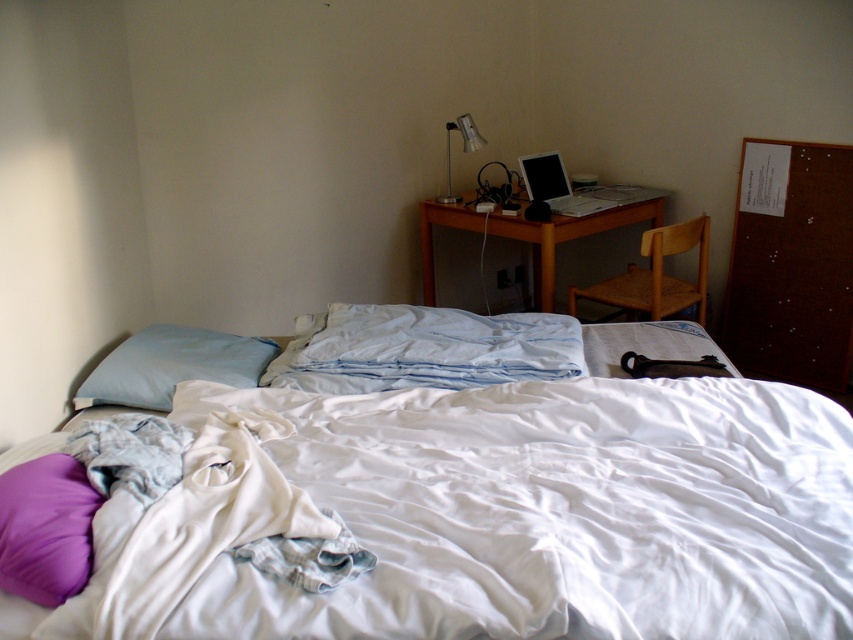
Question: Considering the relative positions of silver metallic laptop at upper right and satin silver lamp at upper center in the image provided, where is silver metallic laptop at upper right located with respect to satin silver lamp at upper center?

Choices:
 (A) right
 (B) left

Answer: (A)

Question: Does wooden chair at right have a lesser width compared to satin silver lamp at upper center?

Choices:
 (A) yes
 (B) no

Answer: (B)

Question: Among these objects, which one is farthest from the camera?

Choices:
 (A) blue cotton sheet at center
 (B) wooden desk at center
 (C) wooden chair at right
 (D) white cotton bed at center

Answer: (B)

Question: Estimate the real-world distances between objects in this image. Which object is closer to the satin silver lamp at upper center?

Choices:
 (A) silver metallic laptop at upper right
 (B) wooden desk at center
 (C) light blue fabric pillow at left

Answer: (B)

Question: Which point is closer to the camera?

Choices:
 (A) wooden desk at center
 (B) wooden chair at right
 (C) blue cotton sheet at center

Answer: (C)

Question: Is wooden chair at right thinner than satin silver lamp at upper center?

Choices:
 (A) no
 (B) yes

Answer: (A)